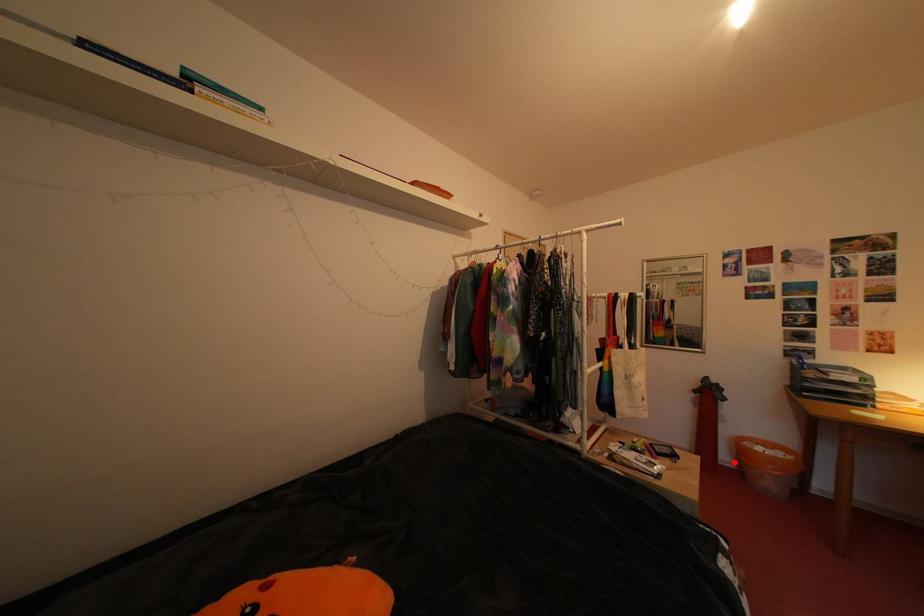
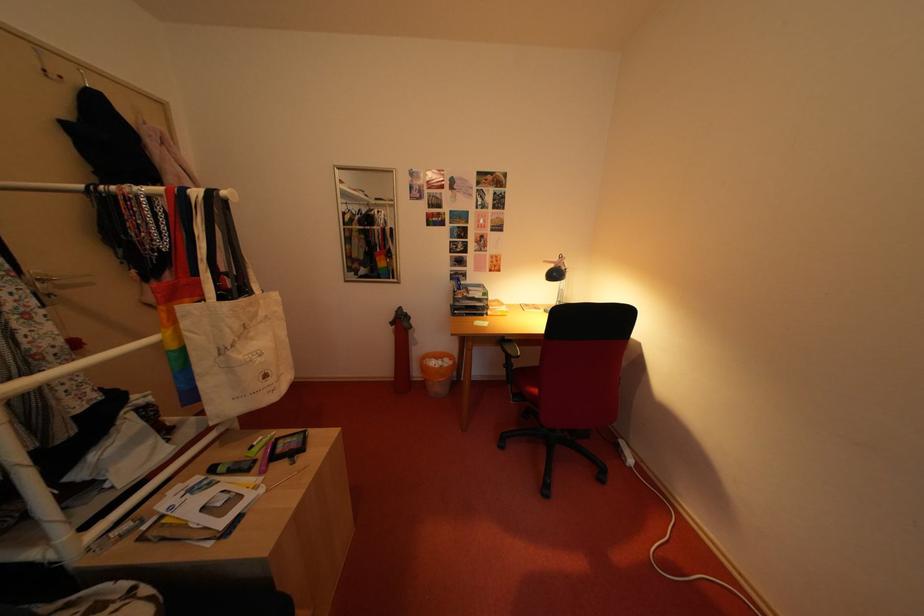
Where in the second image is the point corresponding to the highlighted location from the first image?

(427, 379)